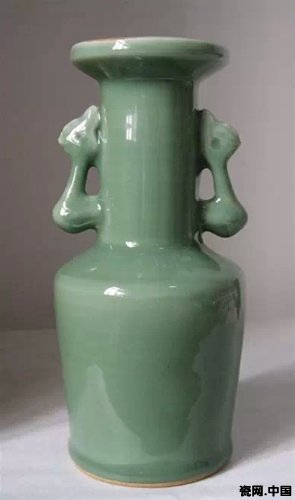
The height and width of the screenshot is (500, 295). I want to click on shadow cast by vase, so click(264, 414).